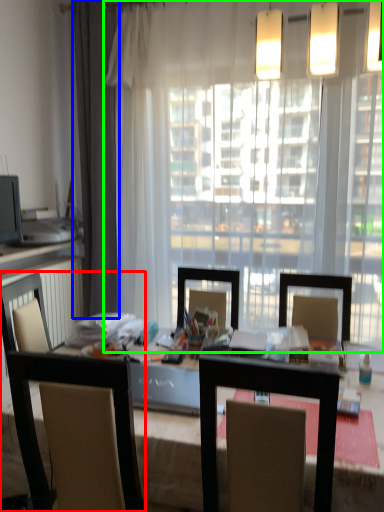
Question: Which is nearer to the chair (highlighted by a red box)? curtain (highlighted by a blue box) or window (highlighted by a green box).

Choices:
 (A) curtain
 (B) window

Answer: (B)